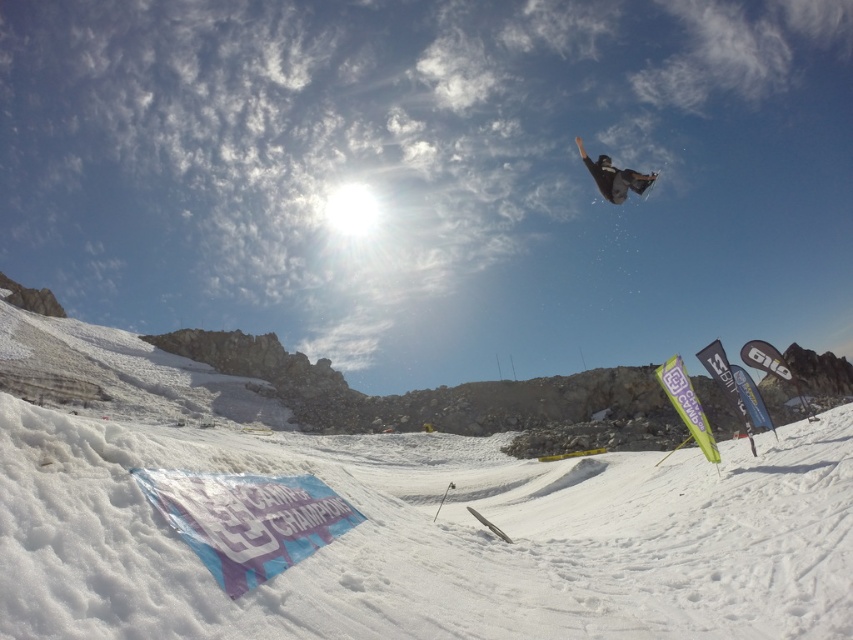
You are a photographer standing at the base of the slope. You want to capture a photo of the matte black snowboarder at upper right while ensuring the white fluffy snow at lower center is visible in the background. Will the snowboarder be taller than the snow in the photo?

The white fluffy snow at lower center is shorter than the matte black snowboarder at upper right, so yes, the snowboarder will appear taller than the snow in the photo.

You are a photographer trying to capture the snowboarder midair. You notice the white fluffy snow at lower center and the black matte snowboard at upper center in your frame. Which object is closer to the camera based on their positions?

The white fluffy snow at lower center is closer to the camera than the black matte snowboard at upper center because objects lower in the frame are typically closer, and the snowboard is positioned higher up, indicating it might be farther away.